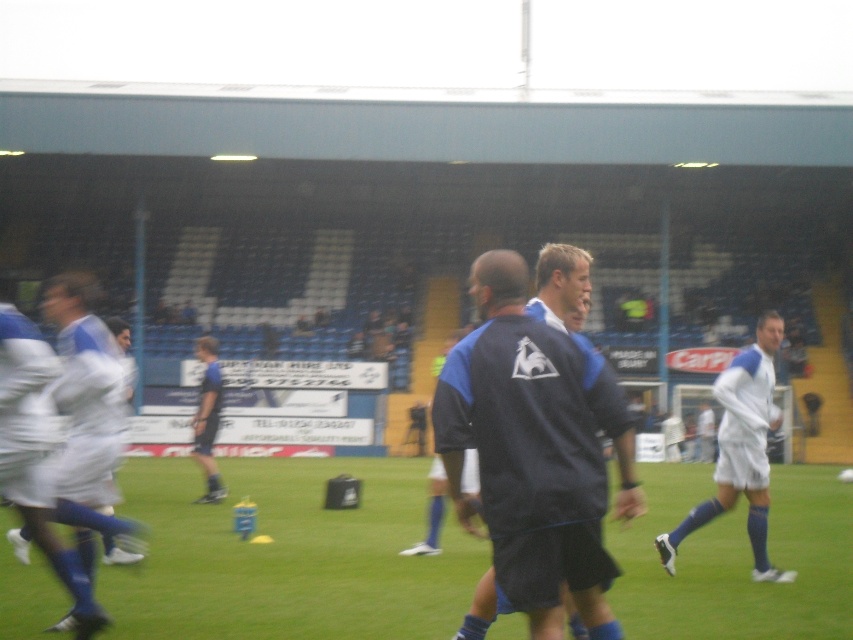
Question: Among these objects, which one is farthest from the camera?

Choices:
 (A) green grass at center
 (B) blue jersey at center

Answer: (A)

Question: Observing the image, what is the correct spatial positioning of white smooth soccer player at right in reference to dark blue jersey at lower left?

Choices:
 (A) left
 (B) right

Answer: (B)

Question: Which point is closer to the camera?

Choices:
 (A) blue jersey at center
 (B) dark blue jersey at center

Answer: (B)

Question: Does blue jersey at center come behind white fabric shorts at left?

Choices:
 (A) yes
 (B) no

Answer: (B)

Question: Is blue jersey at center positioned behind white fabric shorts at left?

Choices:
 (A) yes
 (B) no

Answer: (B)

Question: Which object is positioned closest to the dark blue jersey at center?

Choices:
 (A) white smooth soccer player at right
 (B) blue jersey at center
 (C) dark blue jersey at lower left
 (D) green grass at center

Answer: (A)